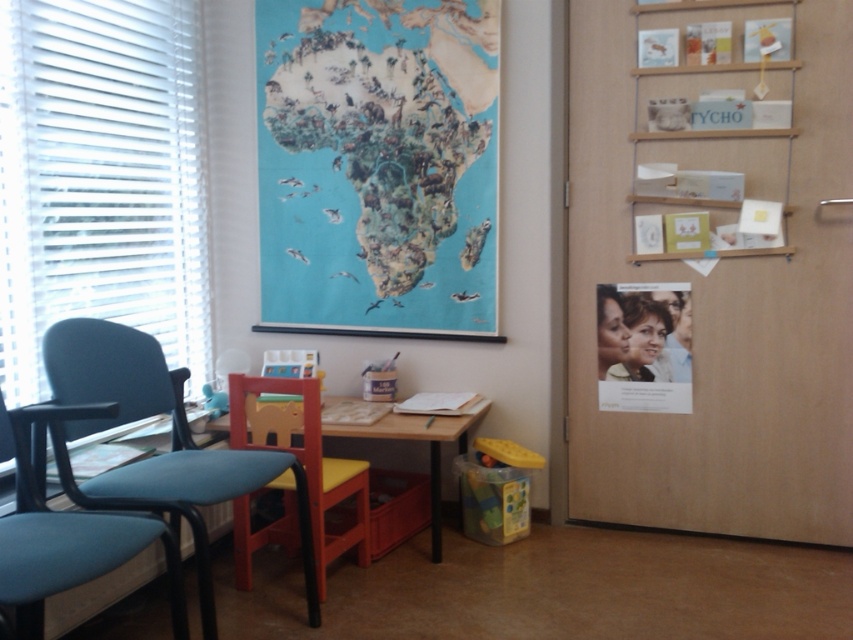
You are a student who needs to sit on the teal fabric swivel chair at left while working on the wooden table at center. Is there enough space for your legs under the table?

The teal fabric swivel chair at left has a lesser width compared to wooden table at center, so there should be enough space for your legs under the table.

Looking at this image, you are trying to place a new poster on the corkboard to the right of the desk. The teal fabric swivel chair at left is in the way. Can you move the chair to the right to make space for the poster?

The teal fabric swivel chair at left is located at point (67, 531), so moving it to the right may not be necessary as the corkboard is to the right of the desk. However, the exact spatial relationship isn

You are standing in the classroom and want to hang a new poster exactly where the matte paper poster at upper right is currently located. What are the coordinates where you should place the new poster?

The coordinates for the matte paper poster at upper right are at point (643,346), so you should place the new poster at those coordinates.